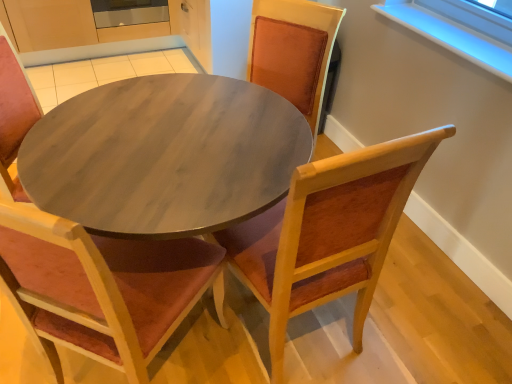
Question: Should I look upward or downward to see wooden chair with velvet cushion at center, acting as the first chair starting from the left?

Choices:
 (A) up
 (B) down

Answer: (B)

Question: Does wooden chair with velvet cushion at center, arranged as the 2th chair when viewed from the right, have a lesser height compared to wooden chair at center, which ranks as the 1th chair in right-to-left order?

Choices:
 (A) yes
 (B) no

Answer: (B)

Question: Is wooden chair with velvet cushion at center, acting as the first chair starting from the left, bigger than wooden chair at center, acting as the 2th chair starting from the left?

Choices:
 (A) no
 (B) yes

Answer: (B)

Question: Is wooden chair with velvet cushion at center, arranged as the 2th chair when viewed from the right, facing away from wooden chair at center, acting as the 2th chair starting from the left?

Choices:
 (A) no
 (B) yes

Answer: (A)

Question: From the image's perspective, would you say wooden chair with velvet cushion at center, acting as the first chair starting from the left, is shown under wooden chair at center, acting as the 2th chair starting from the left?

Choices:
 (A) no
 (B) yes

Answer: (B)

Question: From a real-world perspective, is wooden chair with velvet cushion at center, acting as the first chair starting from the left, physically below wooden chair at center, acting as the 2th chair starting from the left?

Choices:
 (A) yes
 (B) no

Answer: (A)

Question: Is wooden chair with velvet cushion at center, acting as the first chair starting from the left, completely or partially outside of wooden chair at center, which ranks as the 1th chair in right-to-left order?

Choices:
 (A) yes
 (B) no

Answer: (A)

Question: Does wooden chair at center, which ranks as the 1th chair in right-to-left order, have a smaller size compared to wooden chair with velvet cushion at center, acting as the first chair starting from the left?

Choices:
 (A) no
 (B) yes

Answer: (B)

Question: Are wooden chair at center, which ranks as the 1th chair in right-to-left order, and wooden chair with velvet cushion at center, arranged as the 2th chair when viewed from the right, beside each other?

Choices:
 (A) yes
 (B) no

Answer: (B)

Question: Considering the relative sizes of wooden chair at center, which ranks as the 1th chair in right-to-left order, and wooden chair with velvet cushion at center, arranged as the 2th chair when viewed from the right, in the image provided, is wooden chair at center, which ranks as the 1th chair in right-to-left order, bigger than wooden chair with velvet cushion at center, arranged as the 2th chair when viewed from the right,?

Choices:
 (A) no
 (B) yes

Answer: (A)

Question: From a real-world perspective, is wooden chair at center, which ranks as the 1th chair in right-to-left order, on top of wooden chair with velvet cushion at center, arranged as the 2th chair when viewed from the right?

Choices:
 (A) yes
 (B) no

Answer: (A)

Question: Is wooden chair at center, which ranks as the 1th chair in right-to-left order, behind wooden chair with velvet cushion at center, arranged as the 2th chair when viewed from the right?

Choices:
 (A) no
 (B) yes

Answer: (B)

Question: Does wooden chair at center, acting as the 2th chair starting from the left, have a greater width compared to wooden chair with velvet cushion at center, arranged as the 2th chair when viewed from the right?

Choices:
 (A) no
 (B) yes

Answer: (A)

Question: From the image's perspective, is wooden chair at center, which ranks as the 1th chair in right-to-left order, positioned above or below wooden chair with velvet cushion at center, acting as the first chair starting from the left?

Choices:
 (A) below
 (B) above

Answer: (B)